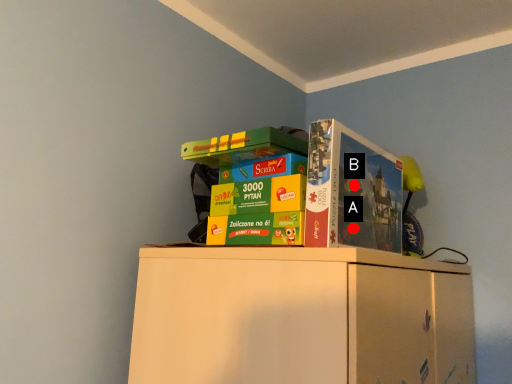
Question: Two points are circled on the image, labeled by A and B beside each circle. Which point is farther from the camera taking this photo?

Choices:
 (A) A is further
 (B) B is further

Answer: (B)